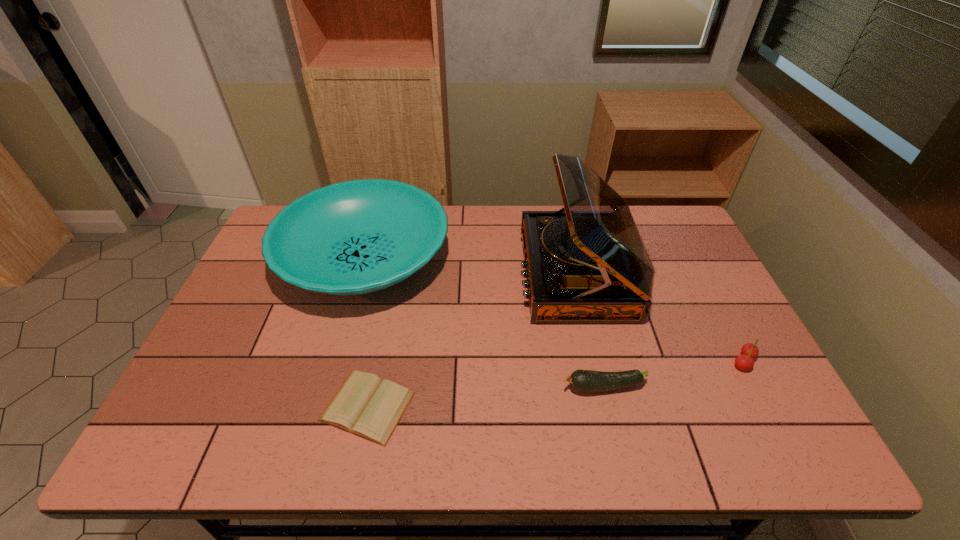
At what (x,y) coordinates should I click in order to perform the action: click on unoccupied position between the rightmost object and the diary. Please return your answer as a coordinate pair (x, y). This screenshot has width=960, height=540. Looking at the image, I should click on (556, 384).

You are a GUI agent. You are given a task and a screenshot of the screen. Output one action in this format:
    pyautogui.click(x=<x>, y=<y>)
    Task: Click on the vacant space that's between the diary and the second tallest object
    This screenshot has height=540, width=960.
    Given the screenshot: What is the action you would take?
    pyautogui.click(x=366, y=332)

This screenshot has width=960, height=540. Identify the location of empty space that is in between the diary and the cherry. (556, 384).

Find the location of a particular element. The height and width of the screenshot is (540, 960). free space that is in between the third shortest object and the shortest object is located at coordinates (556, 384).

Locate an element on the screen. object identified as the closest to the fourth tallest object is located at coordinates (587, 263).

This screenshot has width=960, height=540. I want to click on object that is the second nearest to the second shortest object, so click(749, 351).

What are the coordinates of `vacant space that satisfies the following two spatial constraints: 1. on the back side of the rightmost object; 2. on the front-facing side of the record player` in the screenshot? It's located at (698, 274).

At what (x,y) coordinates should I click in order to perform the action: click on vacant point that satisfies the following two spatial constraints: 1. on the front side of the fourth shortest object; 2. on the right side of the cherry. Please return your answer as a coordinate pair (x, y). The height and width of the screenshot is (540, 960). Looking at the image, I should click on (335, 361).

Identify the location of free space that satisfies the following two spatial constraints: 1. on the front side of the diary; 2. on the left side of the dish. This screenshot has width=960, height=540. (323, 407).

Identify the location of vacant space that satisfies the following two spatial constraints: 1. on the back side of the third shortest object; 2. on the front-facing side of the tallest object. (698, 274).